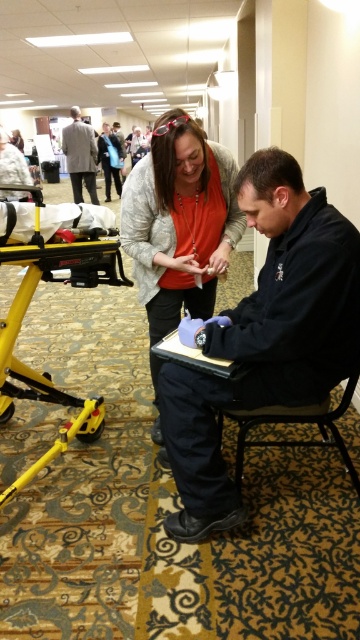
Question: Among these points, which one is nearest to the camera?

Choices:
 (A) (114, 259)
 (B) (162, 262)
 (C) (273, 316)
 (D) (326, 442)

Answer: (C)

Question: Is matte gray sweater at center in front of light gray suit at upper left?

Choices:
 (A) yes
 (B) no

Answer: (A)

Question: Among these objects, which one is farthest from the camera?

Choices:
 (A) black matte jacket at center
 (B) metallic blue chair at lower center
 (C) matte gray sweater at center
 (D) yellow metallic stretcher at lower left

Answer: (C)

Question: Is black matte jacket at center wider than yellow metallic stretcher at lower left?

Choices:
 (A) yes
 (B) no

Answer: (B)

Question: Which point is farther from the camera taking this photo?

Choices:
 (A) click(x=92, y=157)
 (B) click(x=263, y=196)
 (C) click(x=276, y=404)
 (D) click(x=83, y=403)

Answer: (A)

Question: Does metallic blue chair at lower center have a larger size compared to light gray suit at upper left?

Choices:
 (A) no
 (B) yes

Answer: (A)